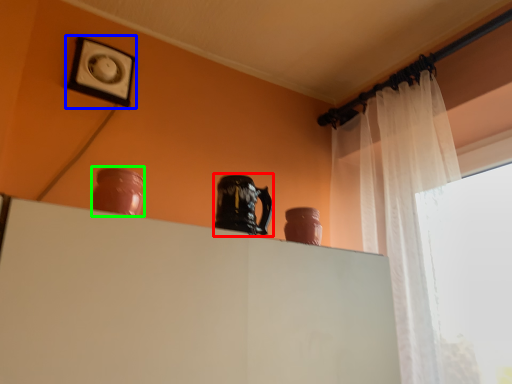
Question: Which object is positioned closest to pottery (highlighted by a red box)? Select from picture frame (highlighted by a blue box) and vase (highlighted by a green box).

Choices:
 (A) picture frame
 (B) vase

Answer: (B)